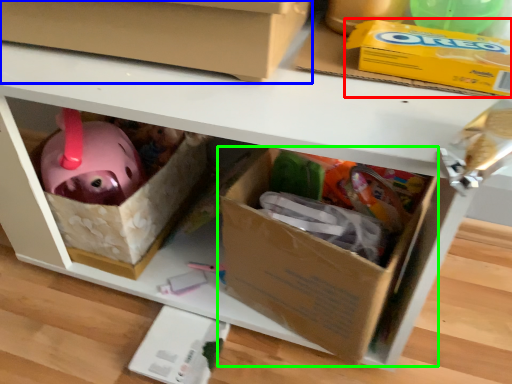
Question: Estimate the real-world distances between objects in this image. Which object is closer to storage box (highlighted by a red box), box (highlighted by a blue box) or box (highlighted by a green box)?

Choices:
 (A) box
 (B) box

Answer: (A)